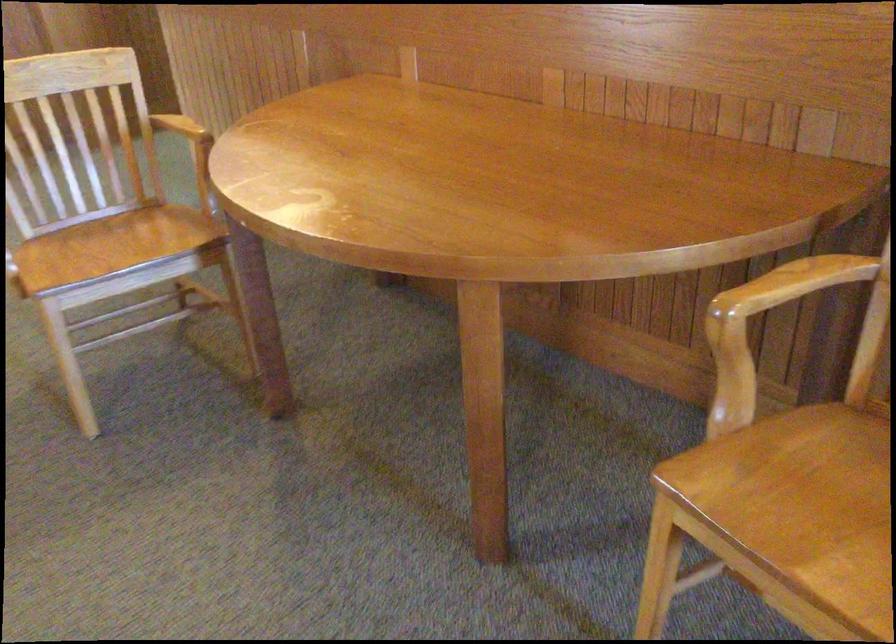
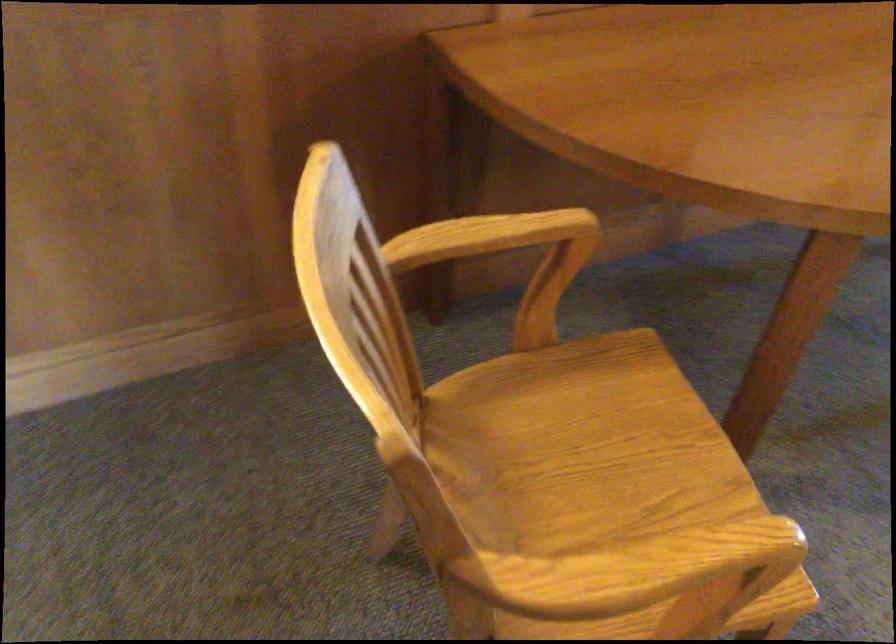
The point at (116,236) is marked in the first image. Where is the corresponding point in the second image?

(574, 456)